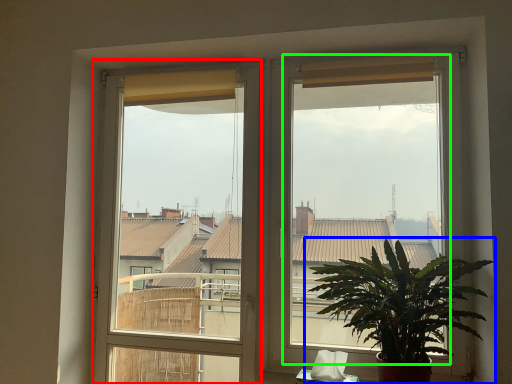
Question: Which object is the farthest from window frame (highlighted by a red box)? Choose among these: houseplant (highlighted by a blue box) or window screen (highlighted by a green box).

Choices:
 (A) houseplant
 (B) window screen

Answer: (A)